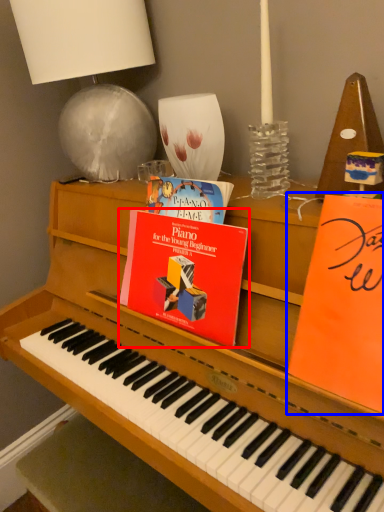
Question: Which point is further to the camera, paperback book (highlighted by a red box) or paperback book (highlighted by a blue box)?

Choices:
 (A) paperback book
 (B) paperback book

Answer: (A)